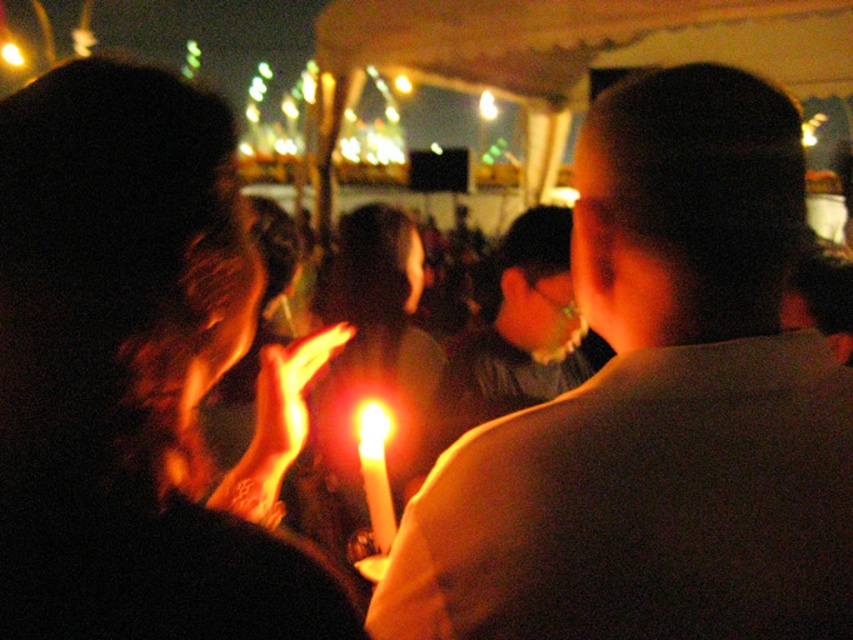
Is matte white candle at center shorter than white wax candle at center?

No.

Is matte white candle at center above white wax candle at center?

Yes, matte white candle at center is above white wax candle at center.

What are the coordinates of `matte white candle at center` in the screenshot? It's located at (657, 410).

The width and height of the screenshot is (853, 640). What are the coordinates of `matte white candle at center` in the screenshot? It's located at (657, 410).

From the picture: Who is lower down, matte white candle at center or matte black candle at center?

matte white candle at center is below.

Is matte white candle at center to the right of matte black candle at center from the viewer's perspective?

Indeed, matte white candle at center is positioned on the right side of matte black candle at center.

Is point (762, 403) positioned in front of point (49, 499)?

No.

This screenshot has width=853, height=640. What are the coordinates of `matte white candle at center` in the screenshot? It's located at (657, 410).

In the scene shown: Is matte black candle at center shorter than white wax candle at center?

No, matte black candle at center is not shorter than white wax candle at center.

Who is lower down, matte black candle at center or white wax candle at center?

white wax candle at center is lower down.

Does point (166, 268) lie in front of point (376, 480)?

Yes.

I want to click on matte black candle at center, so click(x=138, y=376).